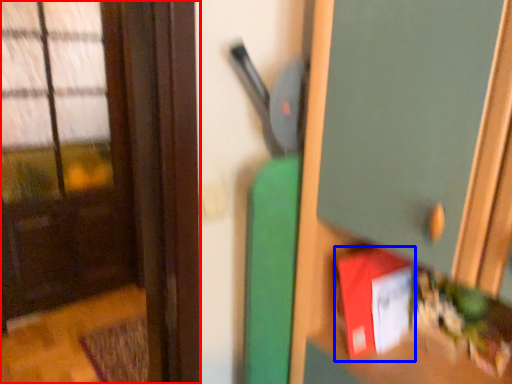
Question: Which object appears farthest to the camera in this image, door (highlighted by a red box) or book (highlighted by a blue box)?

Choices:
 (A) door
 (B) book

Answer: (A)